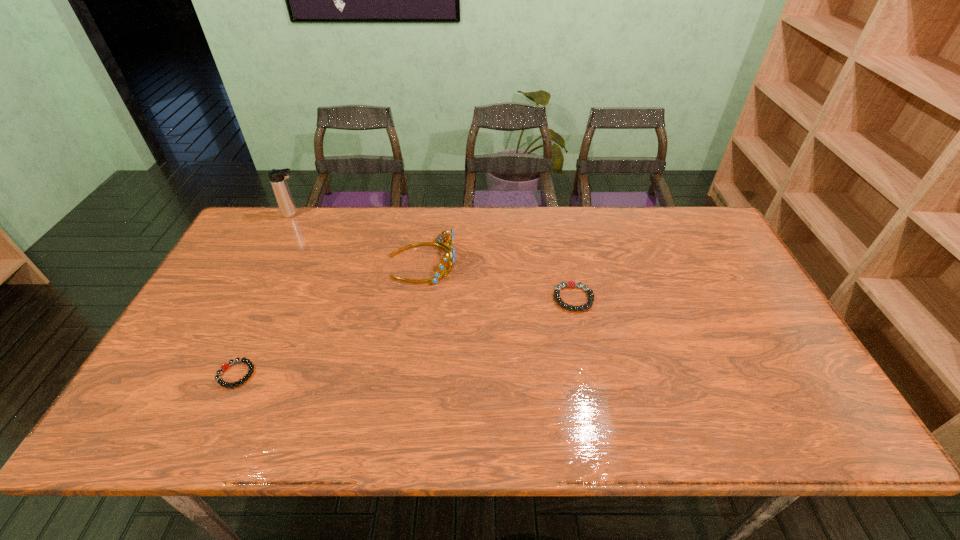
The height and width of the screenshot is (540, 960). What are the coordinates of `thermos bottle` in the screenshot? It's located at (277, 177).

Find the location of a particular element. the farthest object is located at coordinates (277, 177).

You are a GUI agent. You are given a task and a screenshot of the screen. Output one action in this format:
    pyautogui.click(x=<x>, y=<y>)
    Task: Click on the third shortest object
    The image size is (960, 540).
    Given the screenshot: What is the action you would take?
    pyautogui.click(x=438, y=274)

Where is `the third object from left to right`? the third object from left to right is located at coordinates point(438,274).

Where is `the right bracelet`? The height and width of the screenshot is (540, 960). the right bracelet is located at coordinates (571, 284).

Where is `the farther bracelet`? The width and height of the screenshot is (960, 540). the farther bracelet is located at coordinates coord(571,284).

Identify the location of the nearest object. This screenshot has width=960, height=540. (250, 365).

Locate an element on the screen. The height and width of the screenshot is (540, 960). the shortest object is located at coordinates (250, 365).

You are a GUI agent. You are given a task and a screenshot of the screen. Output one action in this format:
    pyautogui.click(x=<x>, y=<y>)
    Task: Click on the free space located 0.290m on the handle side of the thermos bottle
    
    Given the screenshot: What is the action you would take?
    pyautogui.click(x=388, y=214)

I want to click on vacant space located on the front-facing side of the tiara, so click(x=531, y=262).